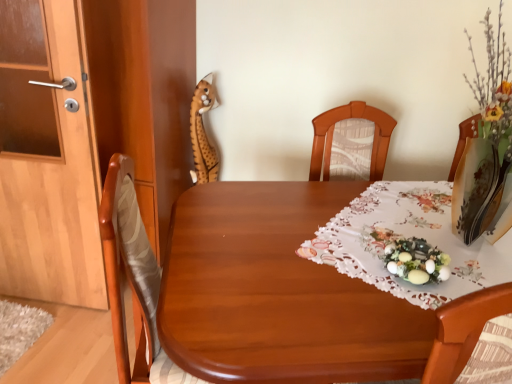
Question: Is spotted plush giraffe at upper left in front of or behind wooden table at center in the image?

Choices:
 (A) front
 (B) behind

Answer: (B)

Question: From the image's perspective, is spotted plush giraffe at upper left positioned above or below wooden table at center?

Choices:
 (A) below
 (B) above

Answer: (B)

Question: Considering the real-world distances, which object is closest to the white lace tablecloth at center?

Choices:
 (A) pastel floral wreath at center
 (B) spotted plush giraffe at upper left
 (C) wooden door at left
 (D) wooden table at center

Answer: (D)

Question: Which of these objects is positioned closest to the white lace tablecloth at center?

Choices:
 (A) wooden door at left
 (B) wooden table at center
 (C) pastel floral wreath at center
 (D) spotted plush giraffe at upper left

Answer: (B)